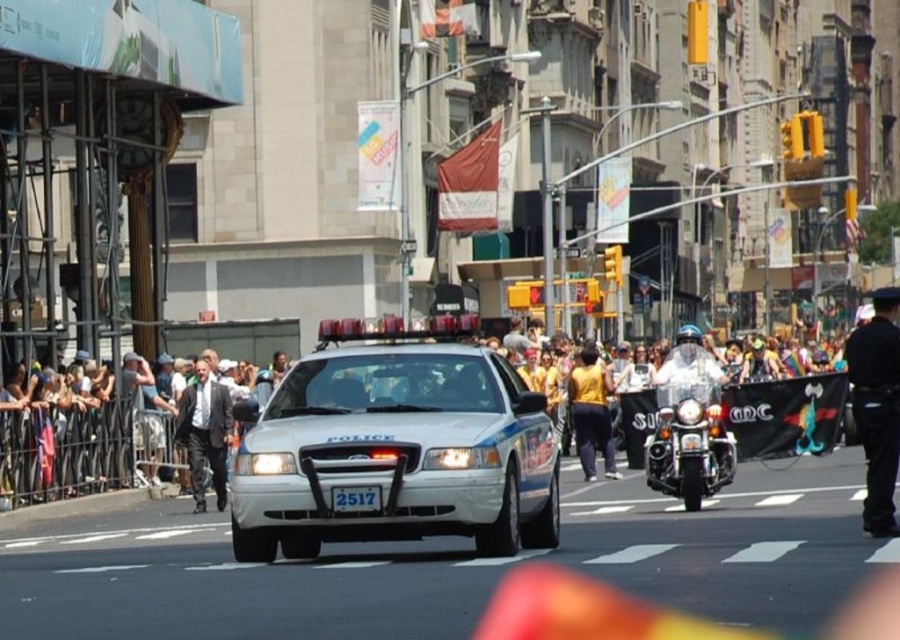
Question: Which point is closer to the camera taking this photo?

Choices:
 (A) tap(590, 378)
 (B) tap(878, 368)

Answer: (B)

Question: Where is dark suit at left located in relation to yellow matte shirt at center in the image?

Choices:
 (A) below
 (B) above

Answer: (A)

Question: Is white glossy motorcycle at center-right above black uniformed officer at right?

Choices:
 (A) yes
 (B) no

Answer: (B)

Question: Is black uniformed officer at right to the left of yellow matte shirt at center from the viewer's perspective?

Choices:
 (A) no
 (B) yes

Answer: (A)

Question: Which point is farther to the camera?

Choices:
 (A) yellow matte shirt at center
 (B) black uniformed officer at right
 (C) white glossy police car at center

Answer: (A)

Question: Estimate the real-world distances between objects in this image. Which object is closer to the yellow matte shirt at center?

Choices:
 (A) dark suit at left
 (B) white glossy motorcycle at center-right

Answer: (A)